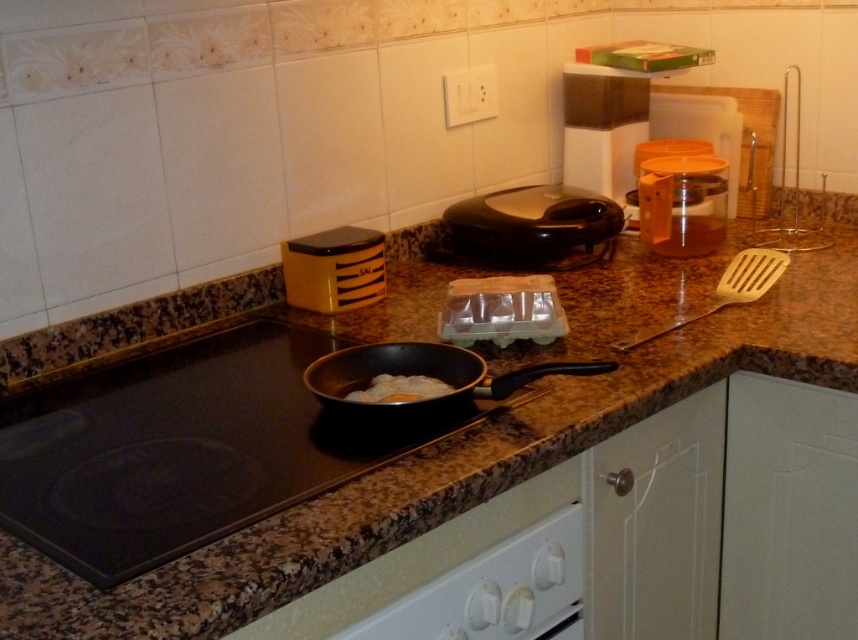
Between black glossy rice cooker at center and yellow matte container at center, which one appears on the right side from the viewer's perspective?

black glossy rice cooker at center is more to the right.

Can you confirm if black glossy rice cooker at center is thinner than yellow matte container at center?

Incorrect, black glossy rice cooker at center's width is not less than yellow matte container at center's.

Which is behind, point (514, 243) or point (307, 285)?

Positioned behind is point (514, 243).

Where is `black glossy rice cooker at center`? The image size is (858, 640). black glossy rice cooker at center is located at coordinates (529, 225).

Is black matte wok at center wider than transparent plastic container at center-right?

Yes, black matte wok at center is wider than transparent plastic container at center-right.

Does black matte wok at center appear under transparent plastic container at center-right?

Correct, black matte wok at center is located below transparent plastic container at center-right.

Image resolution: width=858 pixels, height=640 pixels. In order to click on black matte wok at center in this screenshot , I will do `click(421, 374)`.

Which is in front, point (825, 304) or point (414, 388)?

Point (414, 388) is more forward.

Does brown granite countertop at center appear on the left side of white fluffy food at pan center?

No, brown granite countertop at center is not to the left of white fluffy food at pan center.

You are a GUI agent. You are given a task and a screenshot of the screen. Output one action in this format:
    pyautogui.click(x=<x>, y=<y>)
    Task: Click on the brown granite countertop at center
    The width and height of the screenshot is (858, 640).
    Given the screenshot: What is the action you would take?
    pyautogui.click(x=451, y=468)